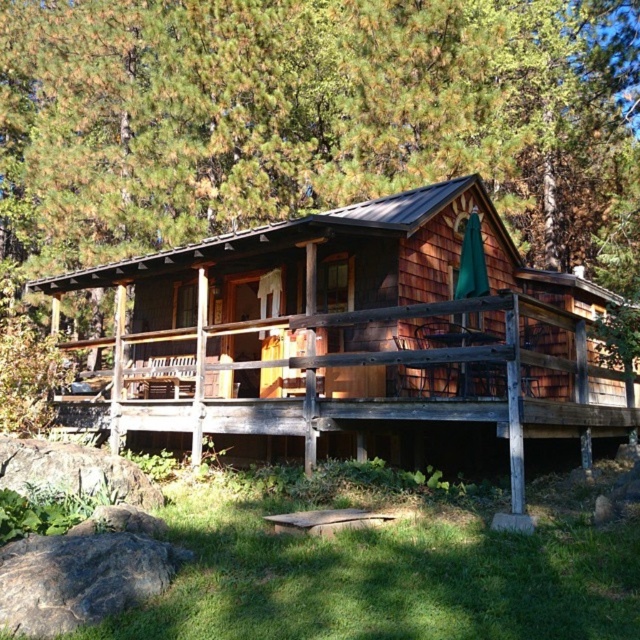
Question: Is green shingles at upper center bigger than weathered wood porch at center?

Choices:
 (A) no
 (B) yes

Answer: (B)

Question: Which point is farther to the camera?

Choices:
 (A) weathered wood porch at center
 (B) green shingles at upper center

Answer: (B)

Question: Where is green shingles at upper center located in relation to weathered wood porch at center in the image?

Choices:
 (A) below
 (B) above

Answer: (B)

Question: Where is green shingles at upper center located in relation to weathered wood porch at center in the image?

Choices:
 (A) above
 (B) below

Answer: (A)